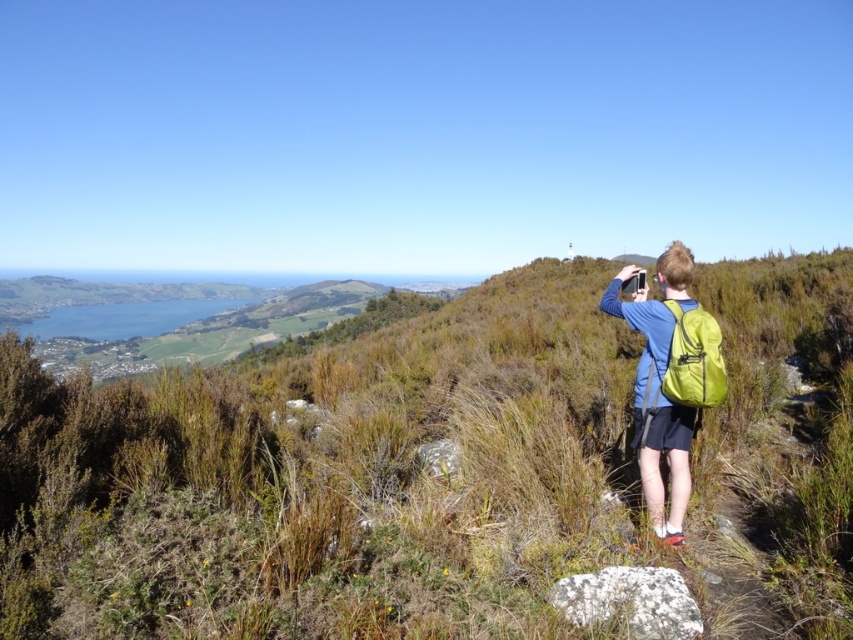
You are a hiker who wants to choose a backpack with more vertical space for your gear. You have two options in the image, the blue fabric backpack at right and the green fabric backpack at right. Which one should you pick?

The blue fabric backpack at right is much taller than the green fabric backpack at right, so you should pick the blue fabric backpack at right for more vertical space.

You are a drone operator trying to capture aerial footage of the green grassy area at center. Based on the coordinates provided, can you determine if the green grassy at center is located in the upper half or lower half of the image?

The position of green grassy at center is at point 0.513 on the y axis, which is just above the middle point of 0.5, so it is in the upper half of the image.